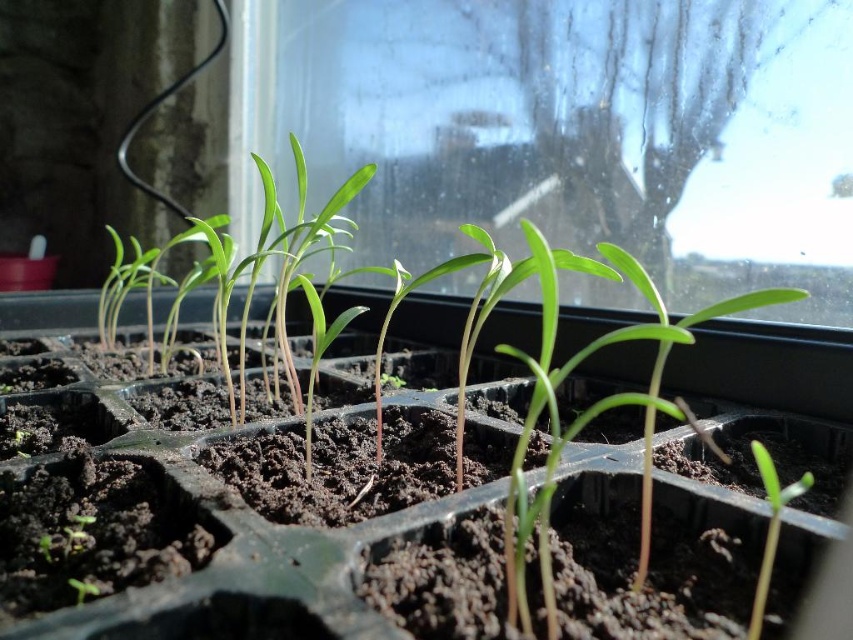
Is green plastic tray at center closer to camera compared to green matte seedling at lower right?

That is False.

Which of these two, green plastic tray at center or green matte seedling at lower right, stands shorter?

With less height is green matte seedling at lower right.

The height and width of the screenshot is (640, 853). What do you see at coordinates (250, 560) in the screenshot?
I see `green plastic tray at center` at bounding box center [250, 560].

Where is `green plastic tray at center`? The image size is (853, 640). green plastic tray at center is located at coordinates (250, 560).

Where is `transparent glass window at center`? transparent glass window at center is located at coordinates (577, 131).

Is transparent glass window at center smaller than green plastic tray at center?

No, transparent glass window at center is not smaller than green plastic tray at center.

Between point (370, 225) and point (309, 602), which one is positioned behind?

The point (370, 225) is behind.

Find the location of a particular element. This screenshot has height=640, width=853. transparent glass window at center is located at coordinates (577, 131).

What do you see at coordinates (577, 131) in the screenshot?
I see `transparent glass window at center` at bounding box center [577, 131].

Is point (456, 280) in front of point (802, 490)?

No, (456, 280) is behind (802, 490).

Is point (764, 58) farther from camera compared to point (770, 515)?

Yes, it is behind point (770, 515).

Identify the location of transparent glass window at center. The image size is (853, 640). (577, 131).